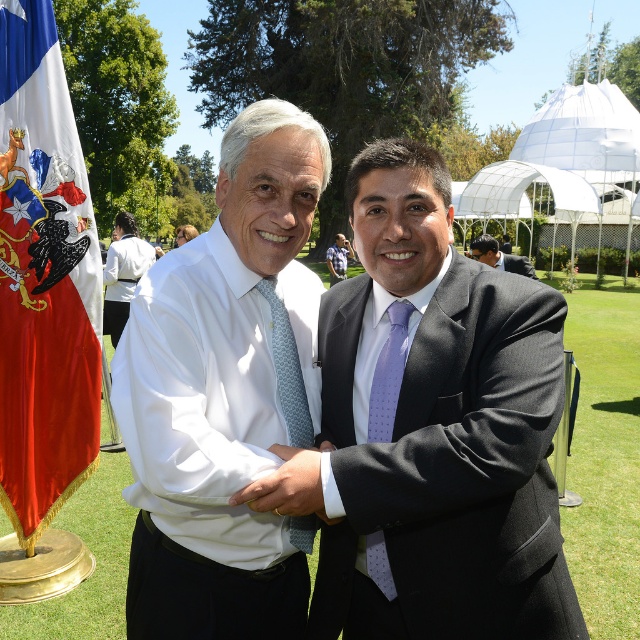
Is point (499, 268) closer to camera compared to point (340, 275)?

Yes, point (499, 268) is in front of point (340, 275).

Which is behind, point (531, 275) or point (336, 243)?

Point (336, 243)

Locate an element on the screen. The height and width of the screenshot is (640, 640). purple satin suit at center is located at coordinates pos(499,257).

Which is above, lavender dotted silk tie at center or purple satin suit at center?

purple satin suit at center is above.

Can you confirm if lavender dotted silk tie at center is thinner than purple satin suit at center?

Correct, lavender dotted silk tie at center's width is less than purple satin suit at center's.

Which is behind, point (381, 538) or point (497, 250)?

Point (497, 250)

Image resolution: width=640 pixels, height=640 pixels. I want to click on lavender dotted silk tie at center, so click(x=388, y=372).

Does white shirt at center have a larger size compared to purple satin suit at center?

No, white shirt at center is not bigger than purple satin suit at center.

Who is lower down, white shirt at center or purple satin suit at center?

Positioned lower is white shirt at center.

This screenshot has width=640, height=640. I want to click on white shirt at center, so click(x=122, y=273).

Image resolution: width=640 pixels, height=640 pixels. Find the location of `white shirt at center`. white shirt at center is located at coordinates (122, 273).